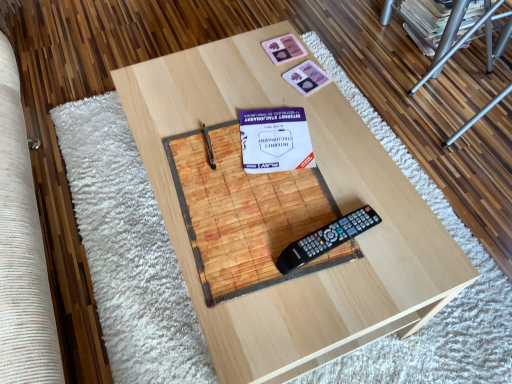
You are a GUI agent. You are given a task and a screenshot of the screen. Output one action in this format:
    pyautogui.click(x=<x>, y=<y>)
    Task: Click on the vacant space to the right of black plastic remote control at center
    
    Given the screenshot: What is the action you would take?
    pyautogui.click(x=401, y=241)